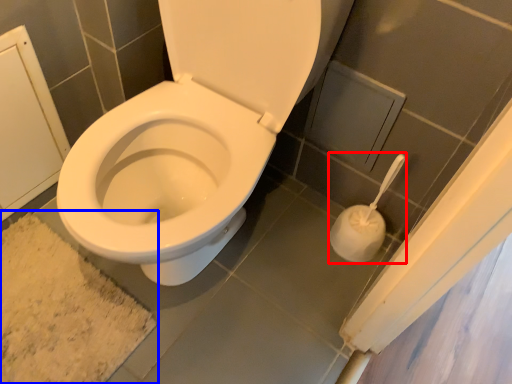
Question: Which object appears farthest to the camera in this image, toilet paper (highlighted by a red box) or bath mat (highlighted by a blue box)?

Choices:
 (A) toilet paper
 (B) bath mat

Answer: (B)